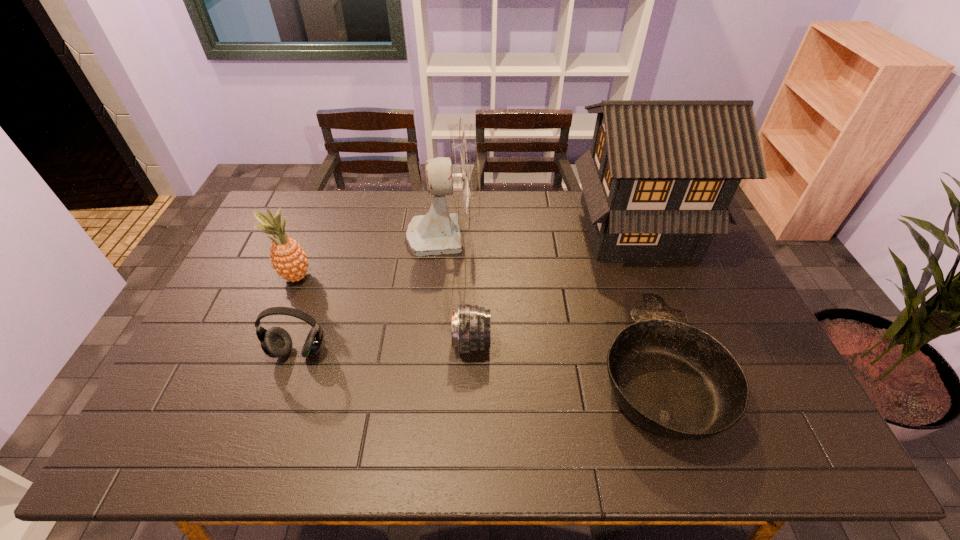
Identify the location of dollhouse. The height and width of the screenshot is (540, 960). (657, 182).

At what (x,y) coordinates should I click in order to perform the action: click on fan. Please return your answer as a coordinate pair (x, y). Looking at the image, I should click on (437, 233).

Find the location of `pineapple`. pineapple is located at coordinates (289, 260).

This screenshot has height=540, width=960. I want to click on the fourth tallest object, so click(275, 342).

Locate an element on the screen. telephoto lens is located at coordinates (471, 324).

You are a GUI agent. You are given a task and a screenshot of the screen. Output one action in this format:
    pyautogui.click(x=<x>, y=<y>)
    Task: Click on the frying pan
    This screenshot has height=540, width=960.
    Given the screenshot: What is the action you would take?
    pyautogui.click(x=676, y=381)

Image resolution: width=960 pixels, height=540 pixels. I want to click on vacant point located on the front-facing side of the dollhouse, so click(661, 292).

This screenshot has height=540, width=960. I want to click on free region located 0.340m in front of the fan to blow air, so click(579, 234).

The width and height of the screenshot is (960, 540). Find the location of `free space located on the right of the pineapple`. free space located on the right of the pineapple is located at coordinates (336, 277).

Where is `vacant region located on the ear cups of the headset`? vacant region located on the ear cups of the headset is located at coordinates (281, 402).